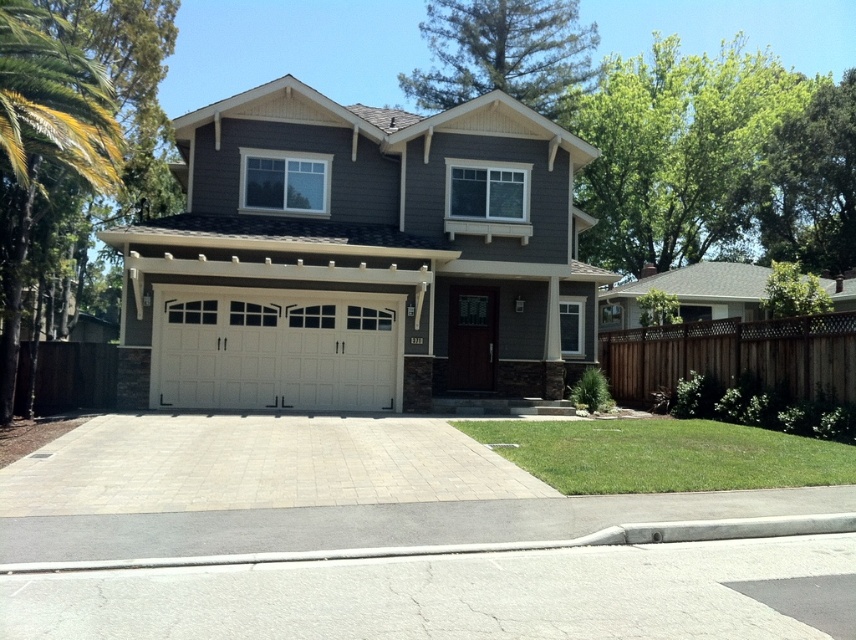
Question: Is white wood garage door at center to the left of gray asphalt driveway at lower center from the viewer's perspective?

Choices:
 (A) yes
 (B) no

Answer: (A)

Question: Which of the following is the closest to the observer?

Choices:
 (A) white wood garage door at center
 (B) green leafy palm tree at left

Answer: (B)

Question: Does gray asphalt driveway at lower center have a lesser width compared to white wood/glass garage door at center?

Choices:
 (A) no
 (B) yes

Answer: (A)

Question: Is white wood garage door at center behind gray concrete driveway at center?

Choices:
 (A) yes
 (B) no

Answer: (A)

Question: Which object is closer to the camera taking this photo?

Choices:
 (A) gray asphalt driveway at lower center
 (B) green leafy palm tree at left
 (C) white wood garage door at center
 (D) white wood/glass garage door at center

Answer: (A)

Question: Which object is closer to the camera taking this photo?

Choices:
 (A) gray concrete driveway at center
 (B) white wood garage door at center
 (C) gray asphalt driveway at lower center

Answer: (C)